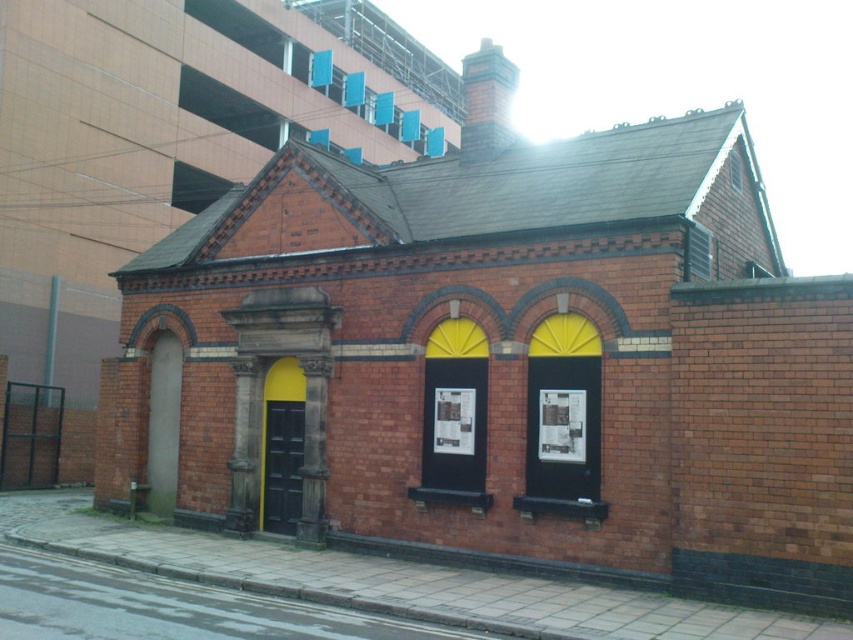
Question: Can you confirm if black wooden door at center is positioned below clear glass window at upper center?

Choices:
 (A) no
 (B) yes

Answer: (B)

Question: Which point is closer to the camera?

Choices:
 (A) black wooden door at center
 (B) clear glass window at upper center

Answer: (B)

Question: In this image, where is black wooden door at center located relative to clear glass window at upper center?

Choices:
 (A) above
 (B) below

Answer: (B)

Question: Does black wooden door at center have a lesser width compared to clear glass window at upper center?

Choices:
 (A) yes
 (B) no

Answer: (B)